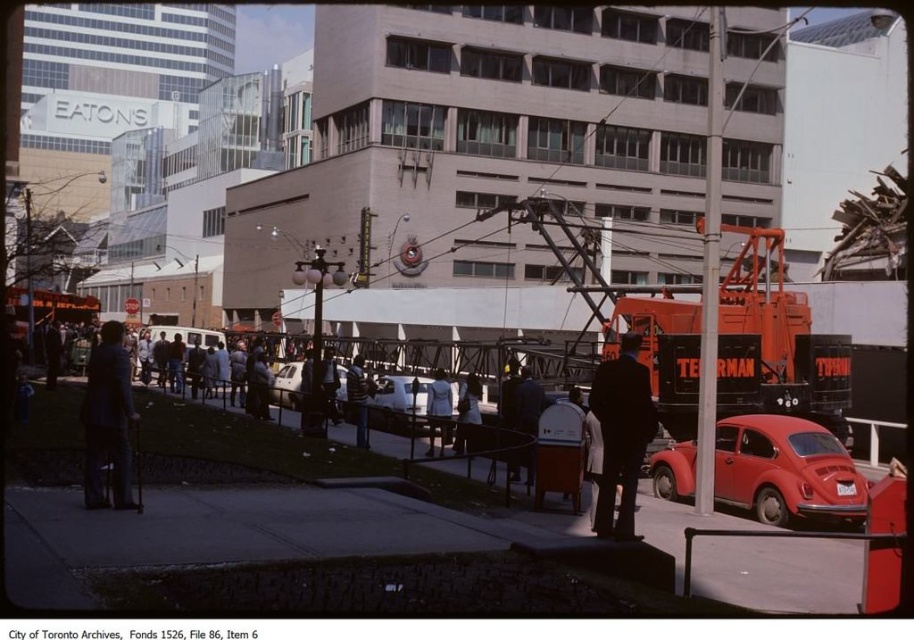
You are a photographer trying to capture both the dark blue suit at center and the light blue fabric coat at center in the same frame. Given that your camera has a maximum focus range of 8 meters, will you be able to include both subjects in your shot?

The dark blue suit at center and the light blue fabric coat at center are 8.30 meters apart from each other. Since the maximum focus range is 8 meters, the distance between them exceeds the camera limit. Therefore, you cannot capture both in the same frame.

You are a photographer standing at the edge of the sidewalk in this urban scene. You want to take a photo of both the dark blue suit at center and the light blue fabric coat at center. Which one will appear larger in your photo?

The dark blue suit at center will appear larger in the photo because it is closer to the viewer than the light blue fabric coat at center.

You are a photographer trying to capture a detailed shot of both the light blue fabric coat at center and the light blue denim jacket at center. Since both are in the center, which one is more to the right?

The light blue fabric coat at center is positioned on the right side of light blue denim jacket at center, so it is more to the right.